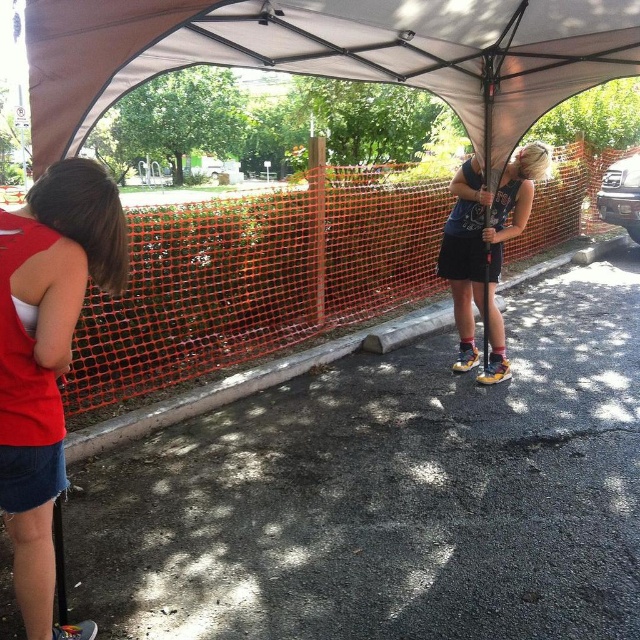
Question: Is denim shorts at left to the right of matte blue tank top at center from the viewer's perspective?

Choices:
 (A) no
 (B) yes

Answer: (A)

Question: Among these points, which one is farthest from the camera?

Choices:
 (A) (476, 221)
 (B) (248, 1)
 (C) (74, 314)
 (D) (208, 52)

Answer: (A)

Question: Which object is farther from the camera taking this photo?

Choices:
 (A) denim shorts at left
 (B) gray fabric canopy at upper center
 (C) brown fabric tent at upper center
 (D) matte blue tank top at center

Answer: (D)

Question: Where is gray fabric canopy at upper center located in relation to denim shorts at left in the image?

Choices:
 (A) right
 (B) left

Answer: (A)

Question: Does gray fabric canopy at upper center lie in front of denim shorts at left?

Choices:
 (A) yes
 (B) no

Answer: (B)

Question: Which is farther from the denim shorts at left?

Choices:
 (A) matte blue tank top at center
 (B) brown fabric tent at upper center

Answer: (A)